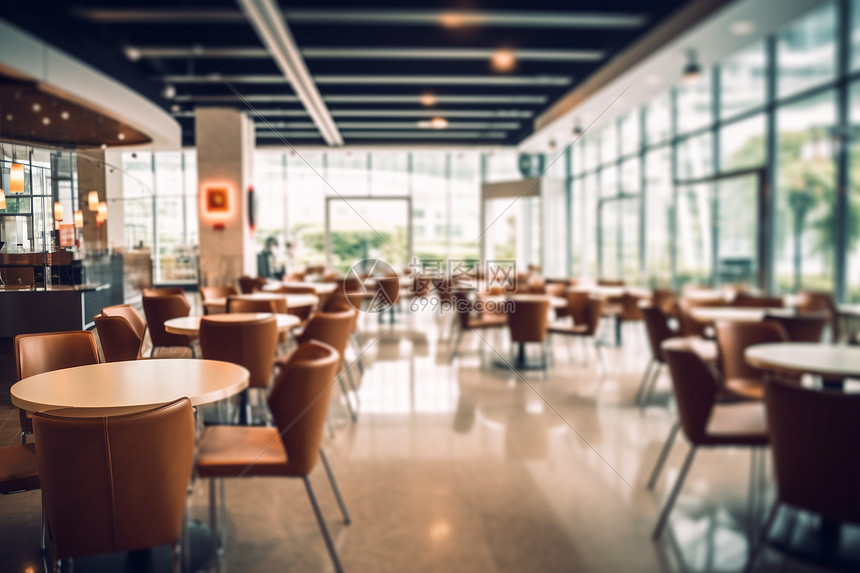
Where is `light fixtures`? The height and width of the screenshot is (573, 860). light fixtures is located at coordinates (14, 175), (58, 215), (91, 200), (103, 213), (501, 62), (456, 21), (431, 97), (439, 121), (215, 201).